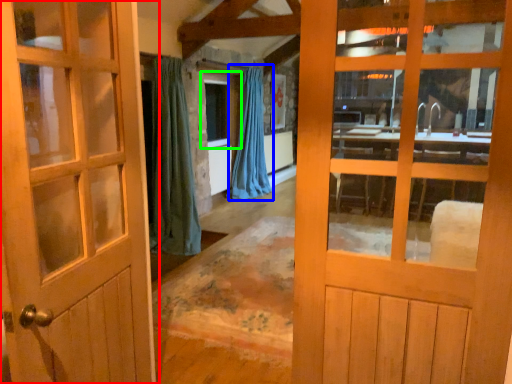
Question: Considering the real-world distances, which object is closest to door (highlighted by a red box)? curtain (highlighted by a blue box) or window (highlighted by a green box).

Choices:
 (A) curtain
 (B) window

Answer: (A)